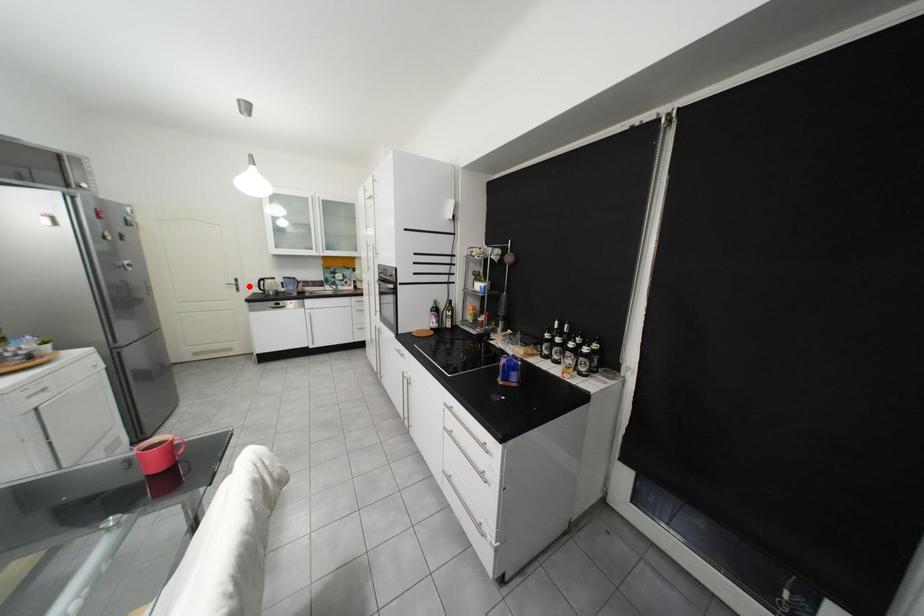
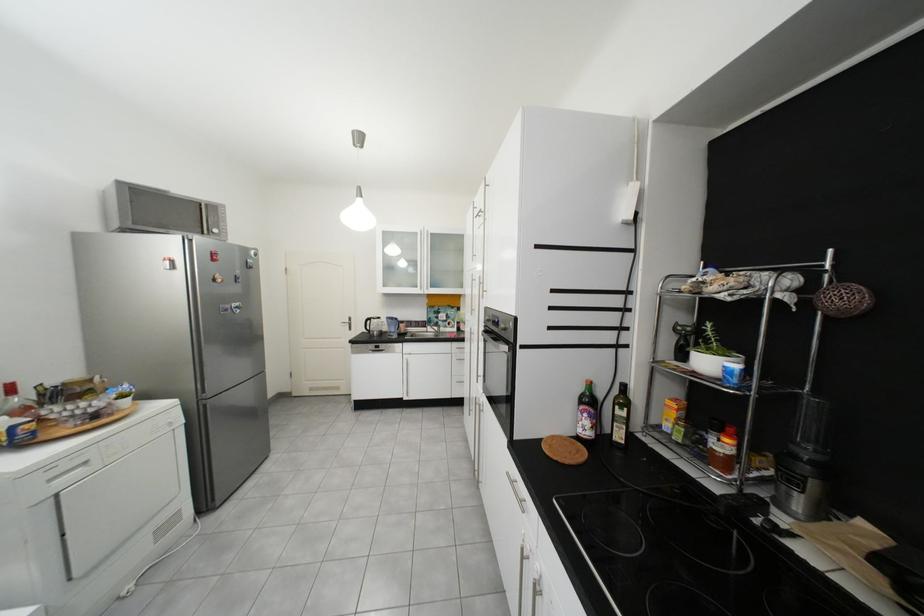
Locate, in the second image, the point that corresponds to the highlighted location in the first image.

(361, 325)